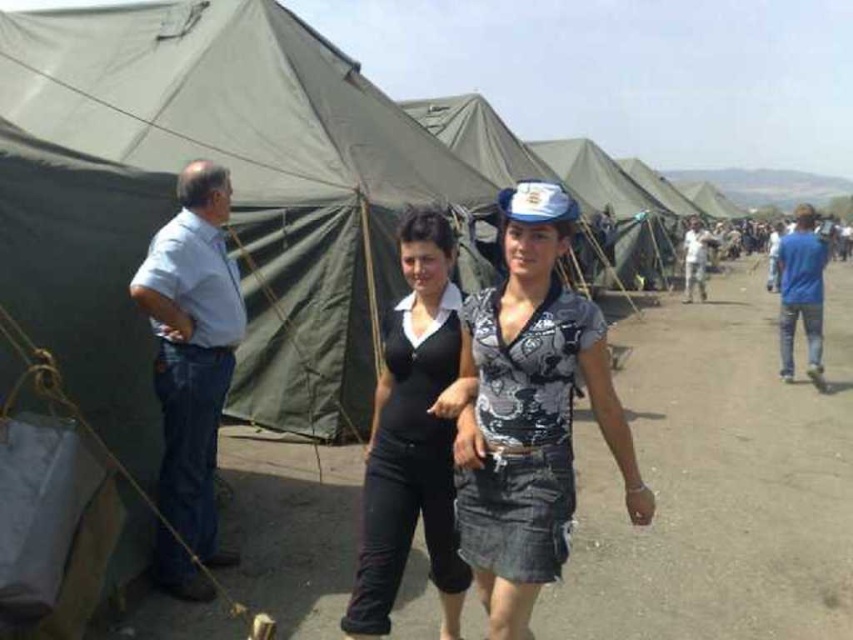
Question: Is the position of black matte pants at center less distant than that of blue denim jeans at right?

Choices:
 (A) yes
 (B) no

Answer: (A)

Question: Observing the image, what is the correct spatial positioning of denim skirt at center in reference to light brown leather jacket at center?

Choices:
 (A) above
 (B) below

Answer: (B)

Question: Among these objects, which one is nearest to the camera?

Choices:
 (A) dirt track at center
 (B) blue denim jeans at right
 (C) light blue denim jeans at left

Answer: (A)

Question: Which point appears farthest from the camera in this image?

Choices:
 (A) (427, 428)
 (B) (828, 282)
 (C) (695, 244)
 (D) (206, 545)

Answer: (B)

Question: Which of these objects is positioned farthest from the black matte pants at center?

Choices:
 (A) blue denim jeans at right
 (B) dirt track at center

Answer: (A)

Question: Does denim skirt at center have a lesser width compared to light brown leather jacket at center?

Choices:
 (A) yes
 (B) no

Answer: (A)